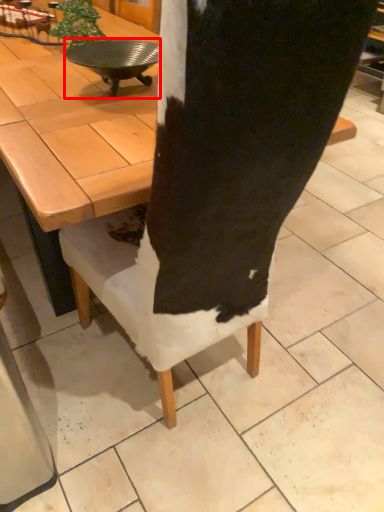
Question: From the image's perspective, what is the correct spatial relationship of round table (annotated by the red box) in relation to coffee table?

Choices:
 (A) above
 (B) below

Answer: (B)